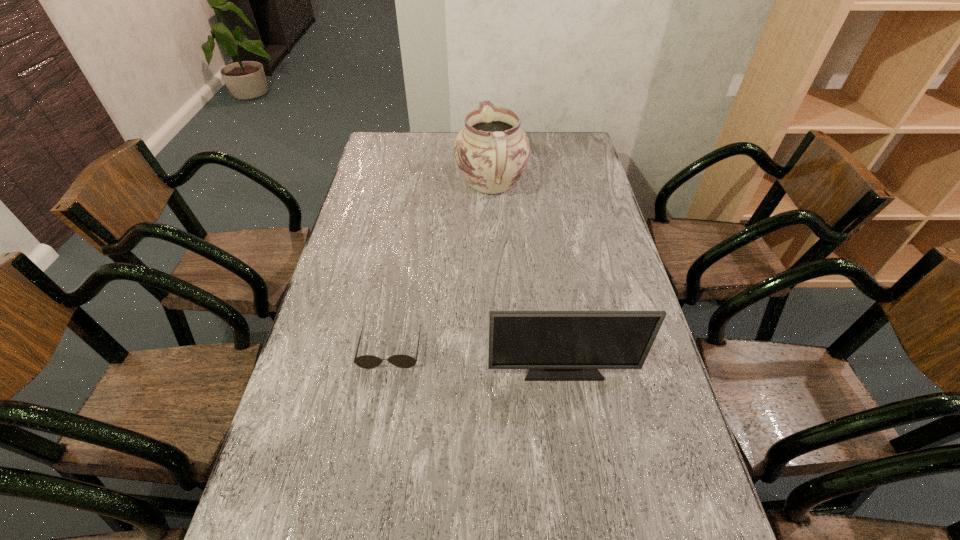
Find the location of `object that ranks as the second closest to the pitcher`. object that ranks as the second closest to the pitcher is located at coordinates (554, 345).

Identify which object is the closest to the leftmost object. Please provide its 2D coordinates. Your answer should be formatted as a tuple, i.e. [(x, y)], where the tuple contains the x and y coordinates of a point satisfying the conditions above.

[(554, 345)]